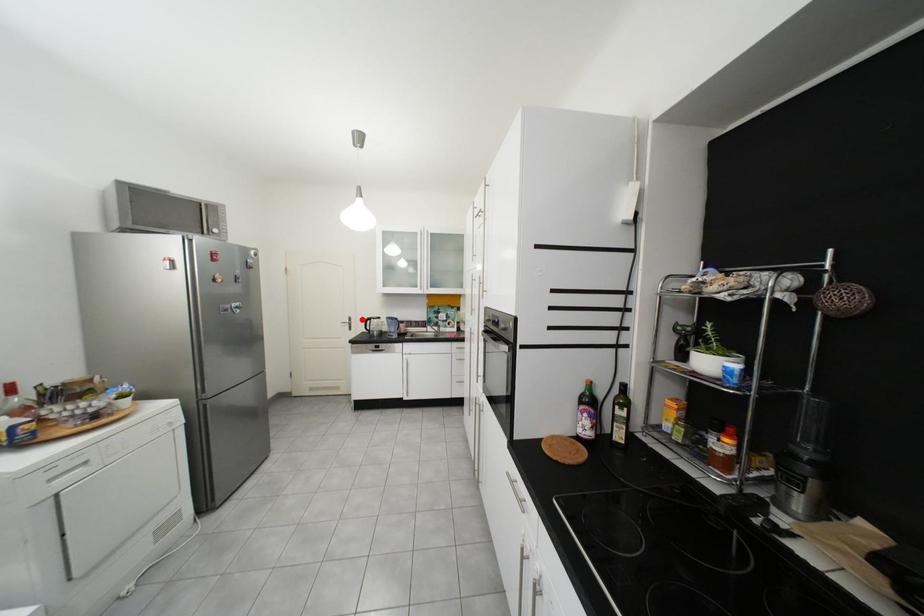
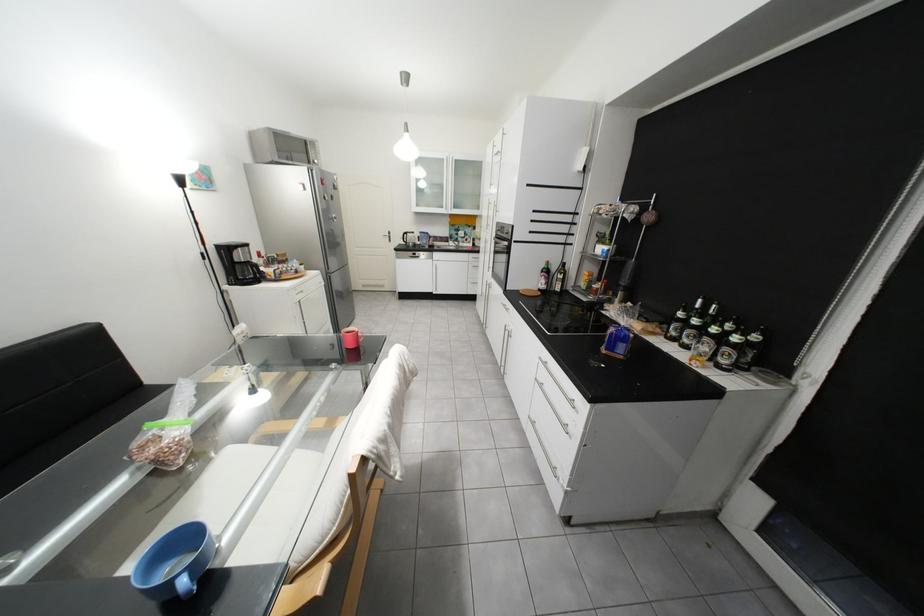
In the second image, find the point that corresponds to the highlighted location in the first image.

(402, 233)